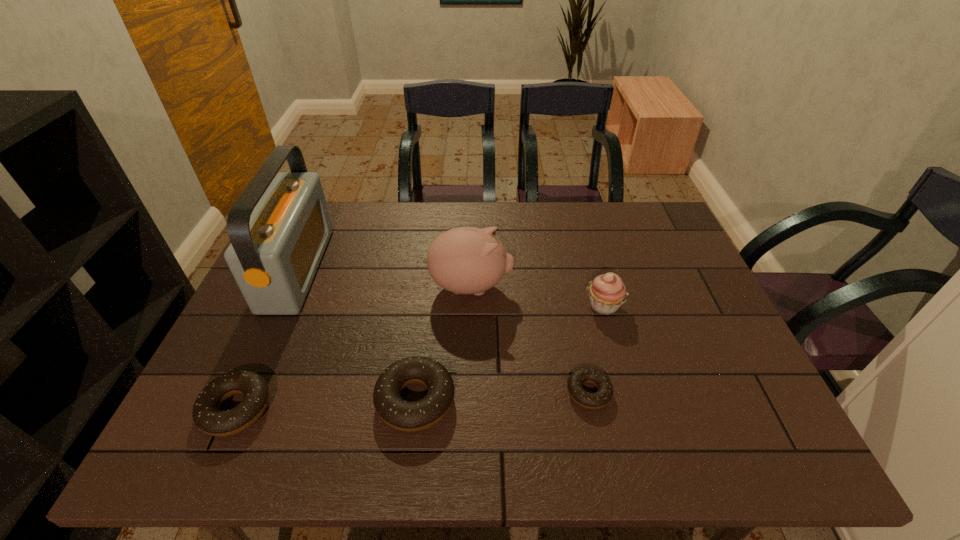
The doughnuts are evenly distributed in the image. To maintain this, where would you place another doughnut on the right? Please point to a free space. Please provide its 2D coordinates. Your answer should be formatted as a tuple, i.e. [(x, y)], where the tuple contains the x and y coordinates of a point satisfying the conditions above.

[(756, 384)]